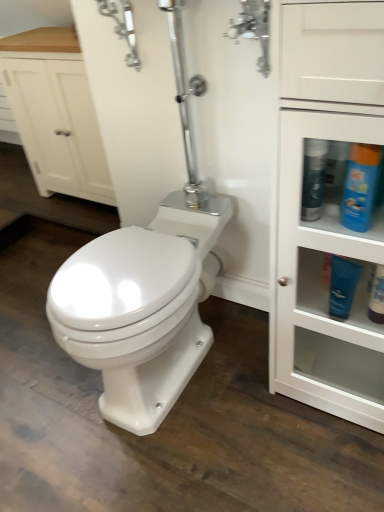
Question: Is white glossy cabinet at right bigger than blue matte lotion at right, the second toiletry in the right-to-left sequence?

Choices:
 (A) yes
 (B) no

Answer: (A)

Question: Can you confirm if white glossy cabinet at right is smaller than blue matte lotion at right, which is counted as the 1th toiletry, starting from the left?

Choices:
 (A) yes
 (B) no

Answer: (B)

Question: Considering the relative sizes of white glossy cabinet at right and blue matte lotion at right, the second toiletry in the right-to-left sequence, in the image provided, is white glossy cabinet at right thinner than blue matte lotion at right, the second toiletry in the right-to-left sequence,?

Choices:
 (A) no
 (B) yes

Answer: (A)

Question: Is white glossy cabinet at right facing towards blue matte lotion at right, which is counted as the 1th toiletry, starting from the left?

Choices:
 (A) no
 (B) yes

Answer: (B)

Question: Is white glossy cabinet at right taller than blue matte lotion at right, the second toiletry in the right-to-left sequence?

Choices:
 (A) yes
 (B) no

Answer: (A)

Question: Is blue matte lotion at right, which is counted as the 1th toiletry, starting from the left, inside white glossy cabinet at right?

Choices:
 (A) yes
 (B) no

Answer: (A)

Question: Would you say matte white lotion at lower right, arranged as the second toiletry when viewed from the left, is part of blue glossy bottle at upper right, which is the 1th cleaning product from right to left,'s contents?

Choices:
 (A) yes
 (B) no

Answer: (B)

Question: Can you confirm if blue glossy bottle at upper right, placed as the 2th cleaning product when sorted from left to right, is taller than matte white lotion at lower right, arranged as the second toiletry when viewed from the left?

Choices:
 (A) no
 (B) yes

Answer: (B)

Question: Are blue glossy bottle at upper right, placed as the 2th cleaning product when sorted from left to right, and matte white lotion at lower right, arranged as the second toiletry when viewed from the left, making contact?

Choices:
 (A) no
 (B) yes

Answer: (A)

Question: From the image's perspective, is blue glossy bottle at upper right, placed as the 2th cleaning product when sorted from left to right, located beneath matte white lotion at lower right, marked as the first toiletry in a right-to-left arrangement?

Choices:
 (A) yes
 (B) no

Answer: (B)

Question: Does blue glossy bottle at upper right, placed as the 2th cleaning product when sorted from left to right, lie in front of matte white lotion at lower right, arranged as the second toiletry when viewed from the left?

Choices:
 (A) no
 (B) yes

Answer: (B)

Question: Would you say blue glossy bottle at upper right, placed as the 2th cleaning product when sorted from left to right, is a long distance from matte white lotion at lower right, arranged as the second toiletry when viewed from the left?

Choices:
 (A) no
 (B) yes

Answer: (A)

Question: From a real-world perspective, is polished chrome faucet at upper center beneath blue glossy bottle at upper right, the first cleaning product in the left-to-right sequence?

Choices:
 (A) yes
 (B) no

Answer: (B)